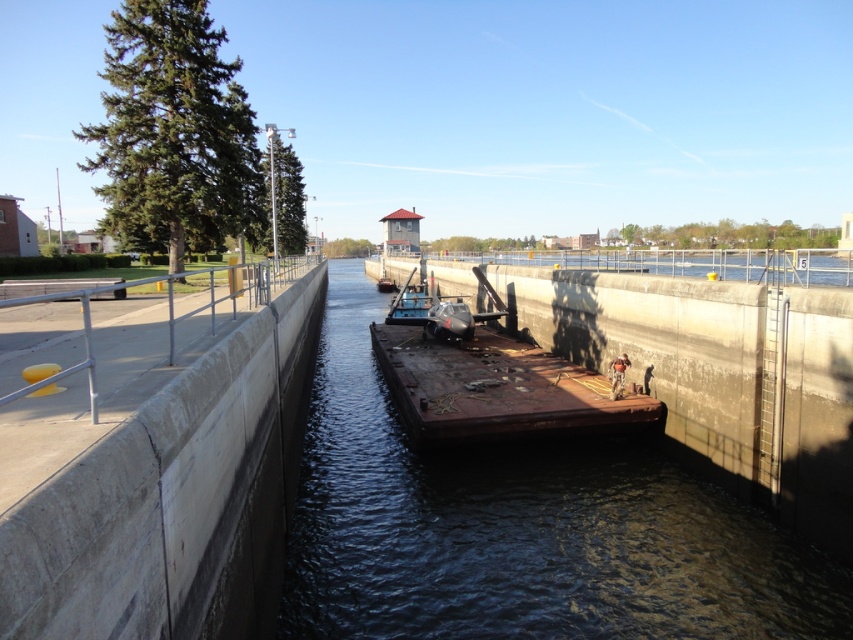
Question: Does rusty metal water at center appear on the left side of rusty metal barge at center?

Choices:
 (A) no
 (B) yes

Answer: (B)

Question: Which of the following is the closest to the observer?

Choices:
 (A) rusty metal barge at center
 (B) rusty metal water at center

Answer: (B)

Question: Is rusty metal water at center bigger than rusty metal barge at center?

Choices:
 (A) no
 (B) yes

Answer: (B)

Question: Is rusty metal water at center positioned in front of rusty metal barge at center?

Choices:
 (A) no
 (B) yes

Answer: (B)

Question: Which point is closer to the camera taking this photo?

Choices:
 (A) (x=422, y=342)
 (B) (x=698, y=550)

Answer: (B)